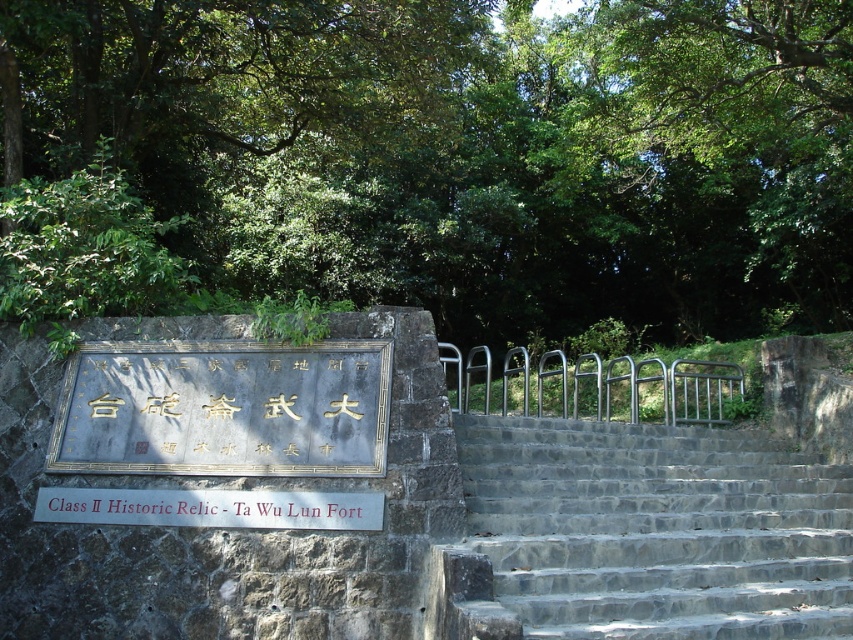
From the picture: You are standing at the point marked as point (850, 486) and want to reach the plaque embedded into the stone wall. Considering the distance between them is 7.44 meters, will you need to walk more than 7 meters to reach the plaque?

The distance between point (850, 486) and the plaque embedded into the stone wall is 7.44 meters, so you will need to walk more than 7 meters to reach the plaque.

You are a tour guide explaining the Ta Wu Lun Fort to visitors. You point out the gray stone stairs at center and the silver metallic balustrade at center. Which of these two objects is shorter in height?

The gray stone stairs at center has a lesser height compared to the silver metallic balustrade at center, so the gray stone stairs at center is shorter in height.

You are a tourist visiting the Ta Wu Lun Fort. You notice the silver metallic balustrade at center and the white wooden sign at center. Which object is closer to you?

The silver metallic balustrade at center is closer to you because the white wooden sign at center is behind it.